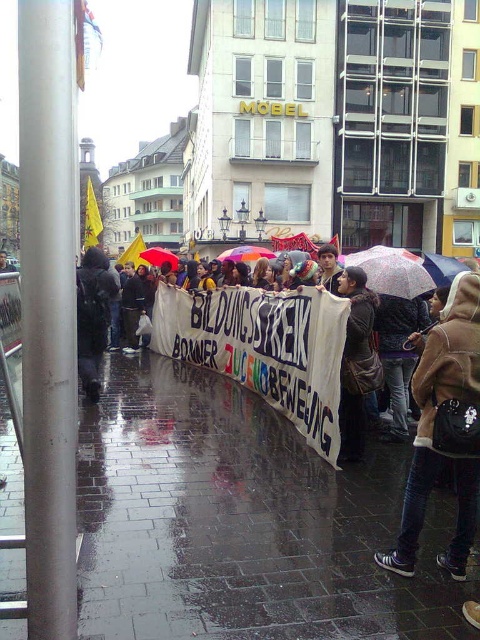
From the picture: Does brown fuzzy coat at lower right appear on the right side of dark gray jacket at left?

Yes, brown fuzzy coat at lower right is to the right of dark gray jacket at left.

The height and width of the screenshot is (640, 480). What are the coordinates of `brown fuzzy coat at lower right` in the screenshot? It's located at (435, 428).

Where is `brown fuzzy coat at lower right`? This screenshot has width=480, height=640. brown fuzzy coat at lower right is located at coordinates (435, 428).

Does wet brick pavement at lower center have a larger size compared to floral-patterned fabric umbrella at center?

Incorrect, wet brick pavement at lower center is not larger than floral-patterned fabric umbrella at center.

Who is positioned more to the right, wet brick pavement at lower center or floral-patterned fabric umbrella at center?

Positioned to the right is floral-patterned fabric umbrella at center.

Does point (130, 538) come farther from viewer compared to point (393, 268)?

No, (130, 538) is closer to viewer.

The height and width of the screenshot is (640, 480). I want to click on wet brick pavement at lower center, so click(241, 522).

Image resolution: width=480 pixels, height=640 pixels. I want to click on wet brick pavement at lower center, so click(x=241, y=522).

Can you confirm if wet brick pavement at lower center is positioned above brown fuzzy coat at lower right?

No.

Who is more distant from viewer, (79,566) or (472,496)?

Point (472,496)

Find the location of `wet brick pavement at lower center`. wet brick pavement at lower center is located at coordinates (241, 522).